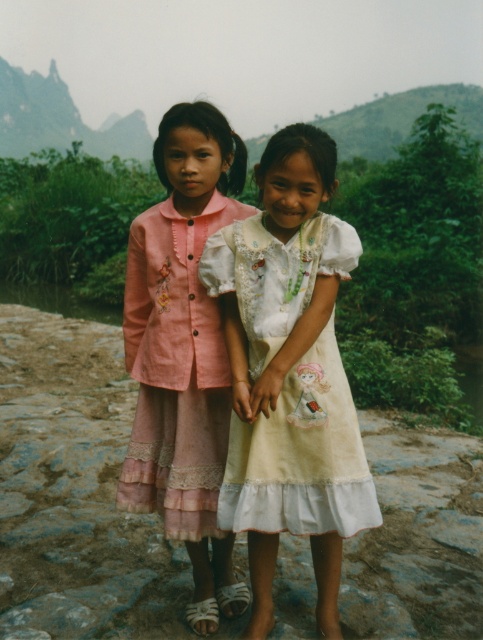
You are a photographer trying to capture both the white cotton dress at center and the pink lace dress at center in a single shot. Which dress should you focus on first to ensure both are in focus?

You should focus on the white cotton dress at center first because it is closer to the viewer than the pink lace dress at center, so adjusting focus from near to far will help both be in focus.

You are a photographer trying to capture both the white cotton dress at center and the pink lace dress at center in a single frame. Based on their positions, which dress should you adjust to ensure both are fully visible in the photo?

The white cotton dress at center is to the right of the pink lace dress at center. To ensure both are fully visible, you should adjust the white cotton dress at center to the left or the pink lace dress at center to the right.

You are a photographer trying to capture both the white cotton dress at center and the pink lace dress at center in a single frame. Since you want both dresses to appear equally prominent, which dress should you move closer to the camera?

The white cotton dress at center is smaller than the pink lace dress at center, so you should move the white cotton dress at center closer to the camera to make it appear larger and balance its prominence with the pink lace dress at center.